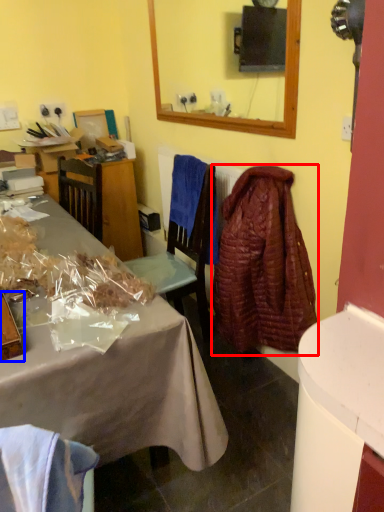
Question: Which object is closer to the camera taking this photo, robe (highlighted by a red box) or box (highlighted by a blue box)?

Choices:
 (A) robe
 (B) box

Answer: (B)